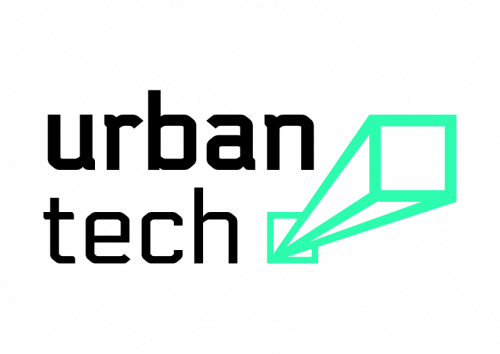
Where is `protruding beam`? protruding beam is located at coordinates (359, 138).